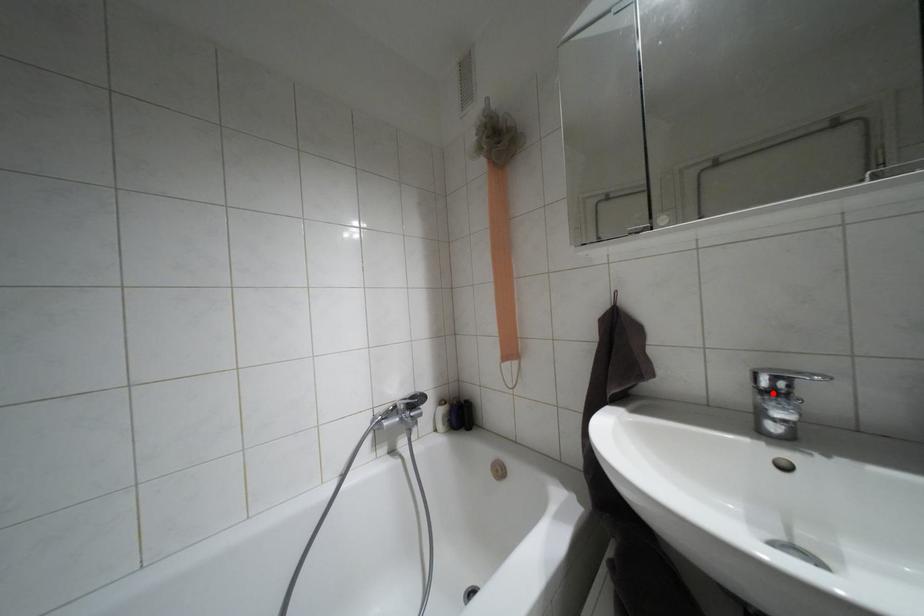
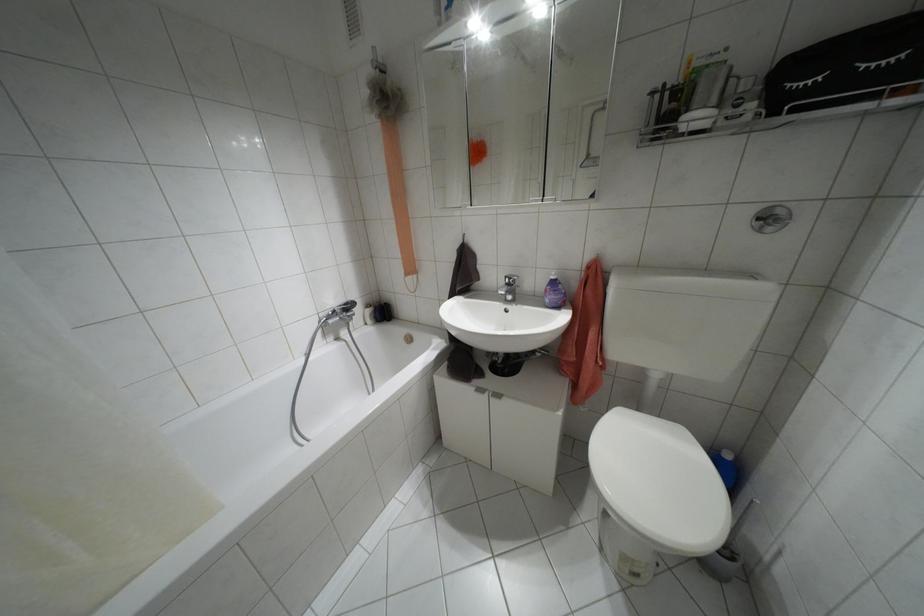
Locate, in the second image, the point that corresponds to the highlighted location in the first image.

(507, 284)